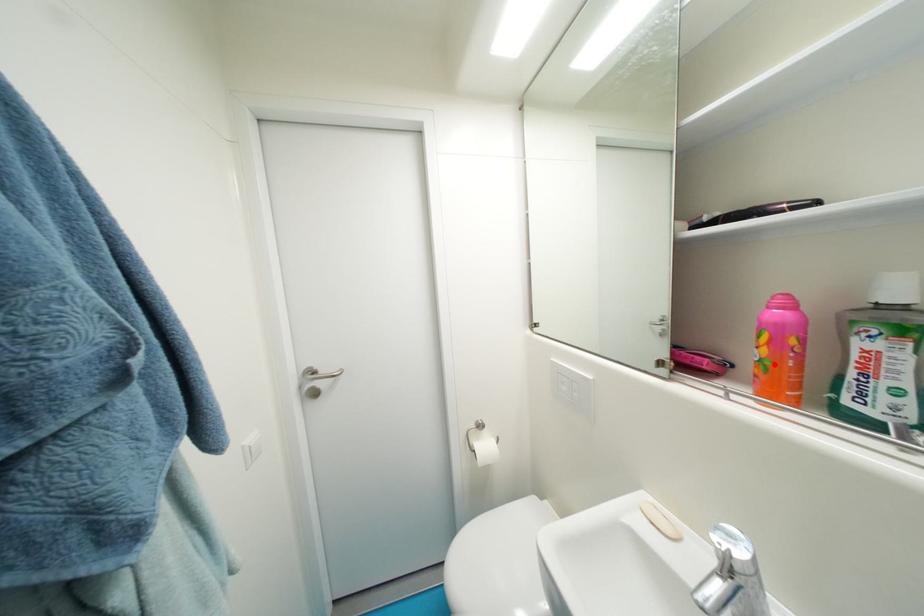
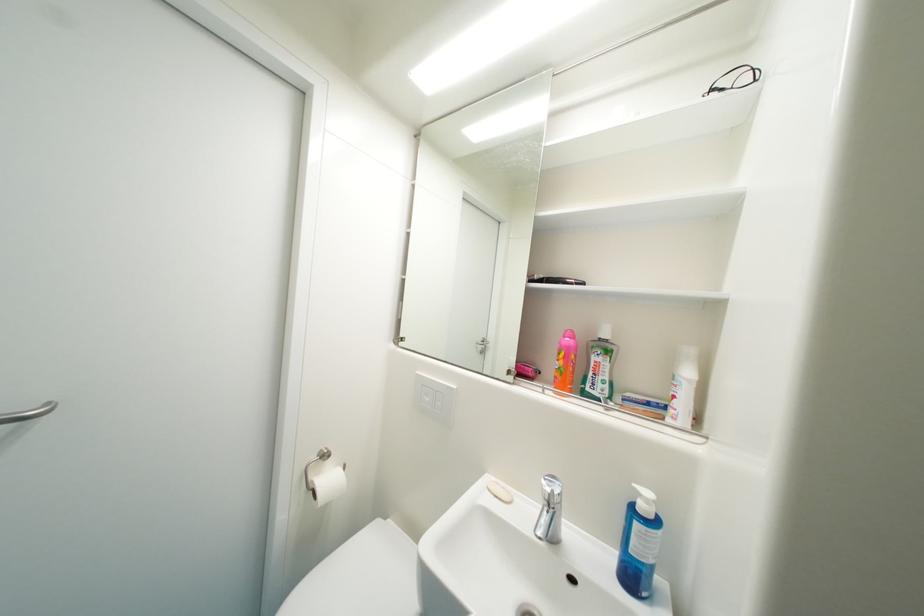
In the second image, find the point that corresponds to the highlighted location in the first image.

(569, 371)